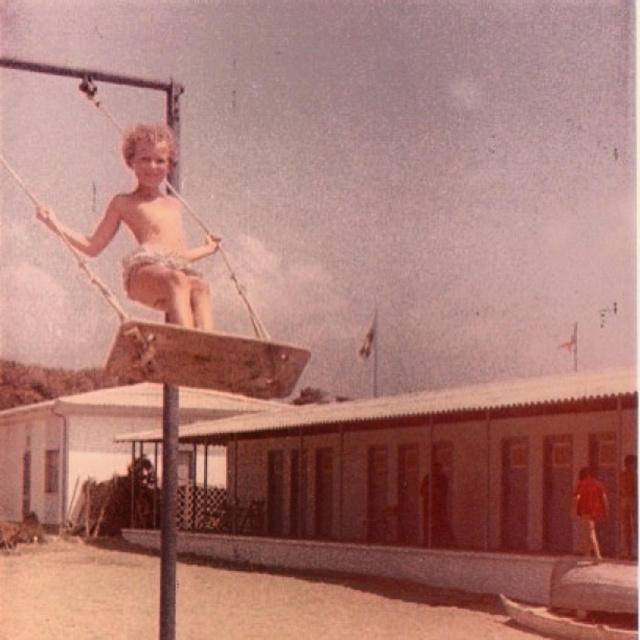
Does point (216, 385) come in front of point (598, 492)?

Yes, point (216, 385) is in front of point (598, 492).

Is wooden swing at center closer to the viewer compared to matte red shirt at right?

Yes, wooden swing at center is closer to the viewer.

What do you see at coordinates (209, 358) in the screenshot? The height and width of the screenshot is (640, 640). I see `wooden swing at center` at bounding box center [209, 358].

Find the location of a particular element. Image resolution: width=640 pixels, height=640 pixels. wooden swing at center is located at coordinates (209, 358).

The width and height of the screenshot is (640, 640). What do you see at coordinates (168, 513) in the screenshot?
I see `metallic pole at center` at bounding box center [168, 513].

Between metallic pole at center and smooth skin shirtless boy at center, which one appears on the right side from the viewer's perspective?

Positioned to the right is smooth skin shirtless boy at center.

Does point (168, 518) lie behind point (432, 516)?

No.

Identify the location of metallic pole at center. (168, 513).

Does light brown wooden swing at upper center appear under metallic pole at center?

Incorrect, light brown wooden swing at upper center is not positioned below metallic pole at center.

Is light brown wooden swing at upper center to the left of metallic pole at center from the viewer's perspective?

In fact, light brown wooden swing at upper center is to the right of metallic pole at center.

Is point (164, 202) closer to viewer compared to point (164, 477)?

Yes.

Identify the location of light brown wooden swing at upper center. Image resolution: width=640 pixels, height=640 pixels. (150, 234).